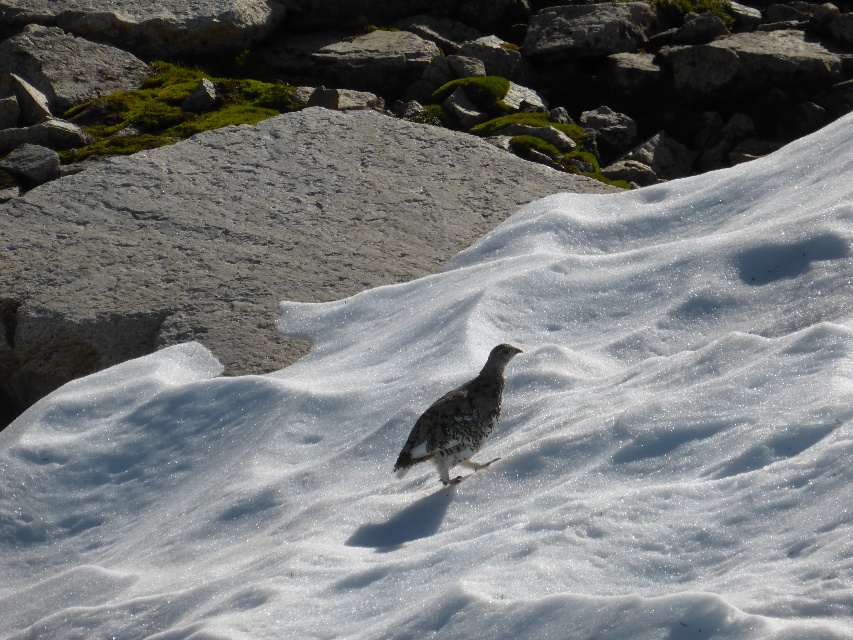
Question: Among these objects, which one is nearest to the camera?

Choices:
 (A) gray rough rock at center
 (B) speckled white bird at center

Answer: (B)

Question: Does gray rough rock at center have a smaller size compared to speckled white bird at center?

Choices:
 (A) yes
 (B) no

Answer: (B)

Question: Does gray rough rock at center appear under speckled white bird at center?

Choices:
 (A) yes
 (B) no

Answer: (B)

Question: Which of the following is the closest to the observer?

Choices:
 (A) (227, 204)
 (B) (467, 465)

Answer: (B)

Question: Is gray rough rock at center below speckled white bird at center?

Choices:
 (A) yes
 (B) no

Answer: (B)

Question: Which of the following is the closest to the observer?

Choices:
 (A) speckled white bird at center
 (B) gray rough rock at center

Answer: (A)